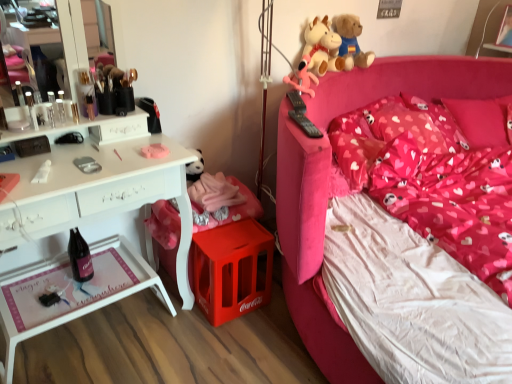
At what (x,y) coordinates should I click in order to perform the action: click on empty space that is ontop of white plastic tray at left (from a real-world perspective). Please return your answer as a coordinate pair (x, y). This screenshot has width=512, height=384. Looking at the image, I should click on (85, 286).